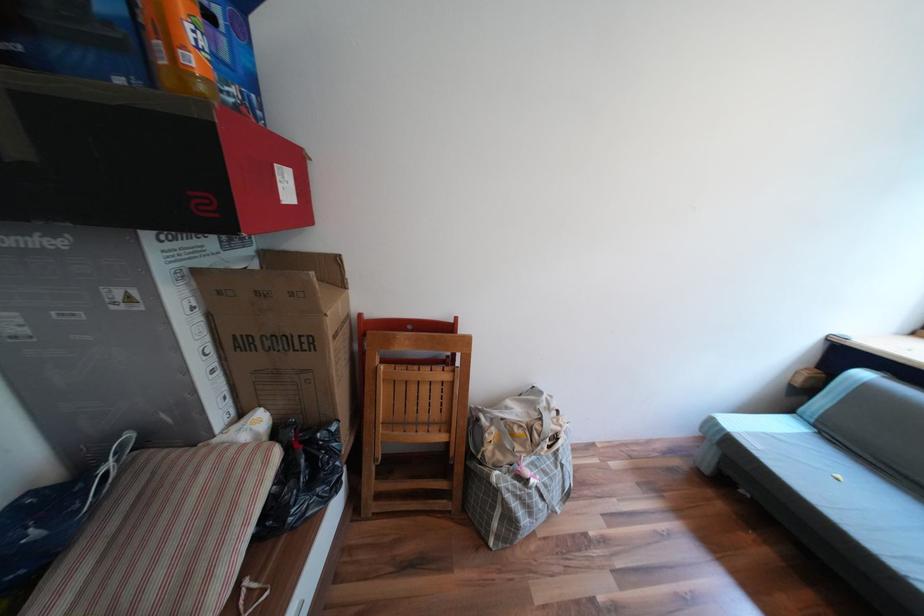
Locate an element on the screen. orange plastic bottle is located at coordinates (177, 47).